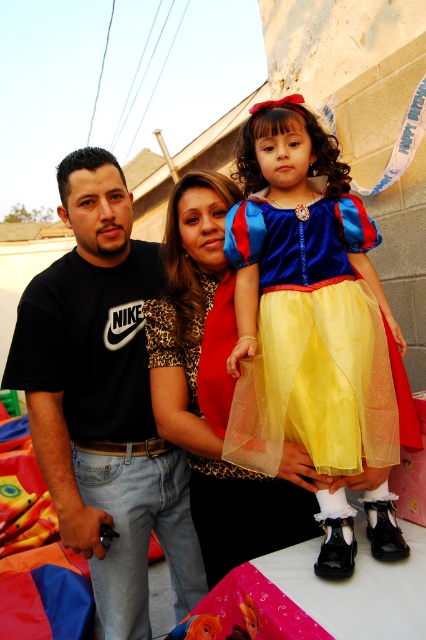
Does velvet yellow dress at center have a lesser height compared to velvet leopard print dress at center?

Correct, velvet yellow dress at center is not as tall as velvet leopard print dress at center.

The image size is (426, 640). In order to click on velvet yellow dress at center in this screenshot , I will do `click(310, 301)`.

Which of these two, velvet yellow dress at center or black nike t-shirt at left, stands shorter?

velvet yellow dress at center is shorter.

Does velvet yellow dress at center appear under black nike t-shirt at left?

No.

Is point (327, 330) closer to camera compared to point (140, 243)?

Yes, point (327, 330) is closer to viewer.

I want to click on velvet yellow dress at center, so click(x=310, y=301).

Based on the photo, does black nike t-shirt at left lie behind velvet leopard print dress at center?

Yes, black nike t-shirt at left is further from the viewer.

Which is in front, point (121, 636) or point (210, 298)?

Point (210, 298) is more forward.

The image size is (426, 640). In order to click on black nike t-shirt at left in this screenshot , I will do `click(103, 401)`.